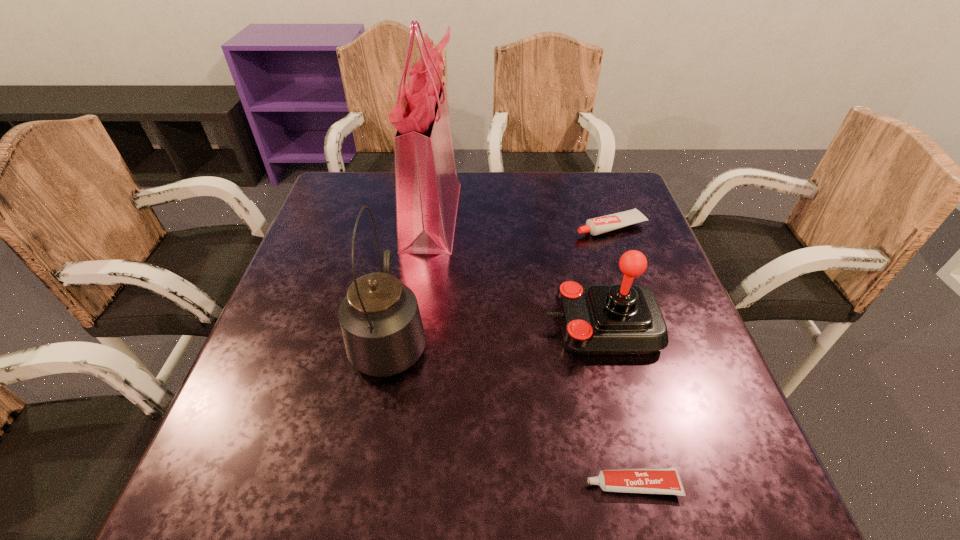
Locate an element on the screen. The height and width of the screenshot is (540, 960). shopping bag is located at coordinates (427, 188).

Identify the location of the fourth shortest object. The height and width of the screenshot is (540, 960). (380, 320).

The width and height of the screenshot is (960, 540). I want to click on joystick, so click(623, 319).

Where is `the farther toothpaste`? This screenshot has height=540, width=960. the farther toothpaste is located at coordinates (595, 226).

The height and width of the screenshot is (540, 960). Identify the location of the fourth tallest object. 595,226.

In order to click on the nearest object in this screenshot , I will do `click(665, 480)`.

The image size is (960, 540). I want to click on the shortest object, so click(665, 480).

Find the location of a particular element. The height and width of the screenshot is (540, 960). vacant space situated on the right of the tallest object is located at coordinates (499, 214).

This screenshot has width=960, height=540. What are the coordinates of `free spot located spout on the kettle` in the screenshot? It's located at (414, 208).

At what (x,y) coordinates should I click in order to perform the action: click on vacant space positioned spout on the kettle. Please return your answer as a coordinate pair (x, y). The image size is (960, 540). Looking at the image, I should click on (402, 275).